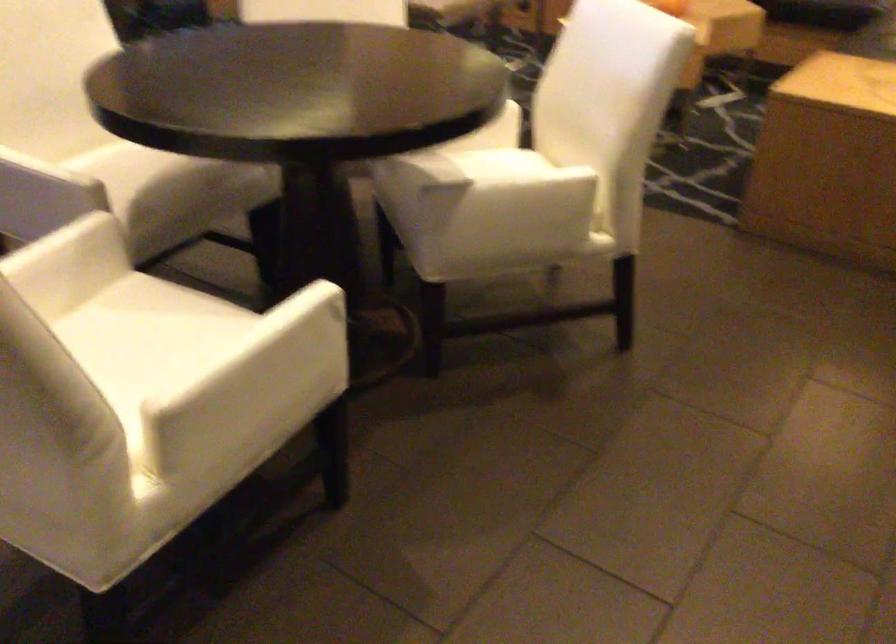
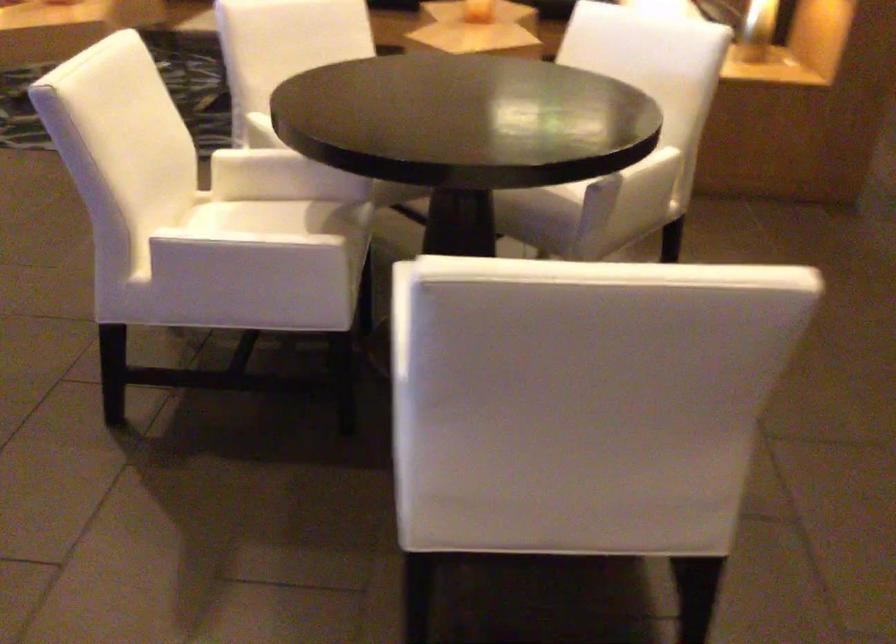
Locate, in the second image, the point that corresponds to point (183, 194) in the first image.

(347, 240)